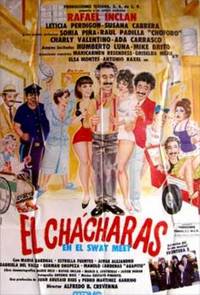
Locate an element on the screen. poster is located at coordinates (91, 73).